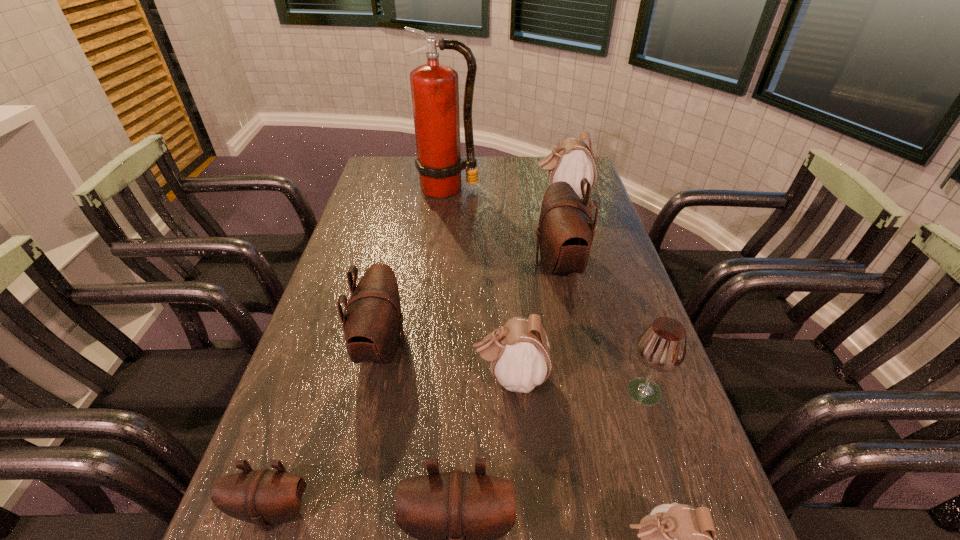
Find the location of a particular element. The height and width of the screenshot is (540, 960). vacant space located on the front-facing side of the second nearest white pouch is located at coordinates click(x=312, y=377).

Where is `vacant space located on the front-facing side of the second nearest white pouch`? This screenshot has height=540, width=960. vacant space located on the front-facing side of the second nearest white pouch is located at coordinates coord(303,377).

The height and width of the screenshot is (540, 960). I want to click on free spot located 0.130m on the front-facing side of the second nearest white pouch, so click(414, 377).

Locate an element on the screen. The height and width of the screenshot is (540, 960). fire extinguisher present at the far edge is located at coordinates (434, 86).

Find the location of a particular element. The width and height of the screenshot is (960, 540). pouch situated at the far edge is located at coordinates (571, 160).

This screenshot has height=540, width=960. I want to click on wineglass that is at the right edge, so click(x=661, y=347).

Find the location of a particular element. The width and height of the screenshot is (960, 540). object at the far right corner is located at coordinates (571, 160).

You are a GUI agent. You are given a task and a screenshot of the screen. Output one action in this format:
    pyautogui.click(x=<x>, y=<y>)
    Task: Click on the vacant space at the far edge of the desktop
    This screenshot has height=540, width=960.
    Given the screenshot: What is the action you would take?
    pyautogui.click(x=518, y=162)

You are a GUI agent. You are given a task and a screenshot of the screen. Output one action in this format:
    pyautogui.click(x=<x>, y=<y>)
    Task: Click on the vacant space at the left edge
    Image resolution: width=960 pixels, height=540 pixels.
    Given the screenshot: What is the action you would take?
    pyautogui.click(x=358, y=241)

Image resolution: width=960 pixels, height=540 pixels. I want to click on vacant space at the right edge of the desktop, so click(x=634, y=291).